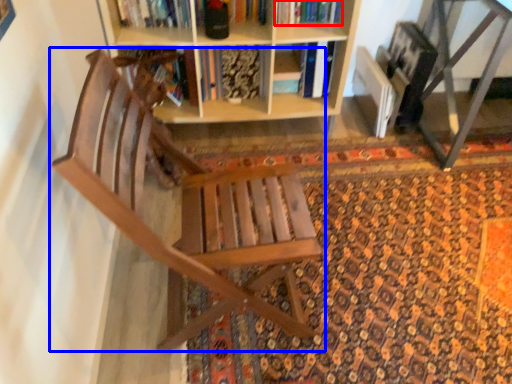
Question: Which point is closer to the camera, book (highlighted by a red box) or chair (highlighted by a blue box)?

Choices:
 (A) book
 (B) chair

Answer: (B)